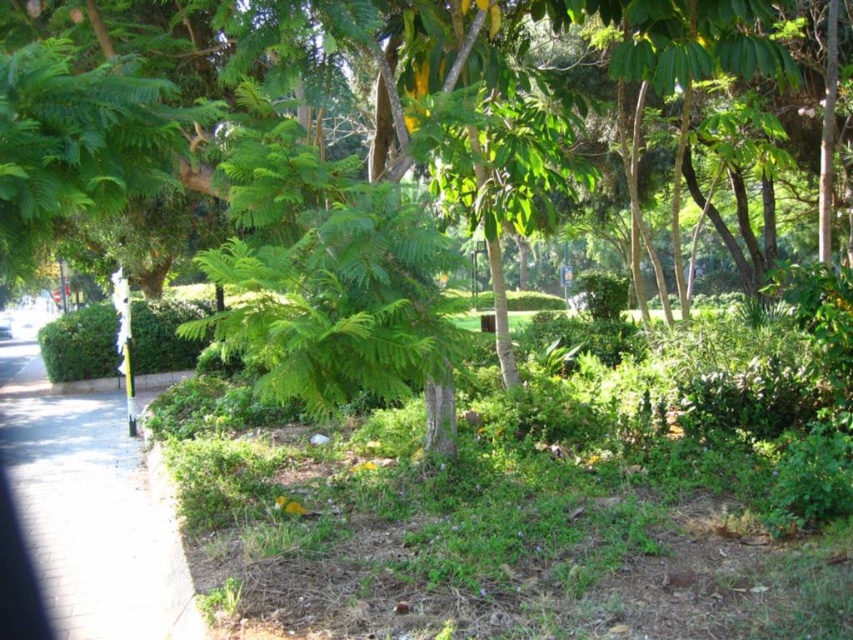
Is green leafy grass at center thinner than green leafy tree at center?

No.

Does green leafy grass at center have a greater height compared to green leafy tree at center?

No, green leafy grass at center is not taller than green leafy tree at center.

Is point (550, 588) positioned behind point (827, 189)?

No, (550, 588) is in front of (827, 189).

The width and height of the screenshot is (853, 640). What are the coordinates of `green leafy grass at center` in the screenshot? It's located at (532, 502).

Between brick paved sidewalk at left and green leafy bush at center, which one has more height?

green leafy bush at center

Does point (134, 604) come farther from viewer compared to point (189, 307)?

No, it is not.

Find the location of a particular element. brick paved sidewalk at left is located at coordinates (90, 512).

Is point (728, 346) farther from camera compared to point (53, 600)?

Yes, point (728, 346) is behind point (53, 600).

Between point (485, 376) and point (142, 472), which one is positioned in front?

Positioned in front is point (142, 472).

Locate an element on the screen. green leafy grass at center is located at coordinates (532, 502).